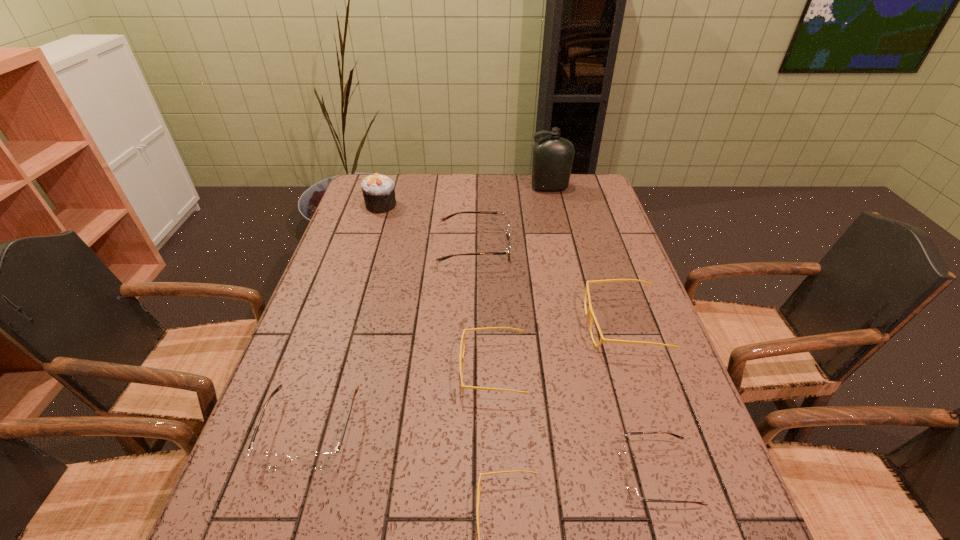
In order to click on empty space between the second smallest beige spectacles and the biggest brown spectacles in this screenshot , I will do `click(484, 309)`.

You are a GUI agent. You are given a task and a screenshot of the screen. Output one action in this format:
    pyautogui.click(x=<x>, y=<y>)
    Task: Click on the vacant region between the rightmost beige spectacles and the third farthest object
    This screenshot has width=960, height=540.
    Given the screenshot: What is the action you would take?
    pyautogui.click(x=549, y=287)

Find the location of `vacant space in between the second biggest brown spectacles and the rightmost beige spectacles`. vacant space in between the second biggest brown spectacles and the rightmost beige spectacles is located at coordinates (468, 377).

This screenshot has height=540, width=960. Identify the location of object identified as the fourth closest to the smallest brown spectacles. [x=322, y=460].

Find the location of a particular element. This screenshot has width=960, height=540. object that is the seventh closest to the tallest object is located at coordinates (479, 483).

Choose which spectacles is the third nearest neighbor to the second biggest beige spectacles. Please provide its 2D coordinates. Your answer should be formatted as a tuple, i.e. [(x, y)], where the tuple contains the x and y coordinates of a point satisfying the conditions above.

[(631, 487)]

Locate an element on the screen. spectacles that can be found as the fourth closest to the cupcake is located at coordinates (322, 460).

Locate which brown spectacles ranks in proximity to the rightmost beige spectacles. Please provide its 2D coordinates. Your answer should be formatted as a tuple, i.e. [(x, y)], where the tuple contains the x and y coordinates of a point satisfying the conditions above.

[(508, 232)]

Where is `brown spectacles that stands as the second closest to the rightmost brown spectacles`? Image resolution: width=960 pixels, height=540 pixels. brown spectacles that stands as the second closest to the rightmost brown spectacles is located at coordinates (508, 232).

Identify which beige spectacles is the third closest to the farthest brown spectacles. Please provide its 2D coordinates. Your answer should be formatted as a tuple, i.e. [(x, y)], where the tuple contains the x and y coordinates of a point satisfying the conditions above.

[(479, 483)]